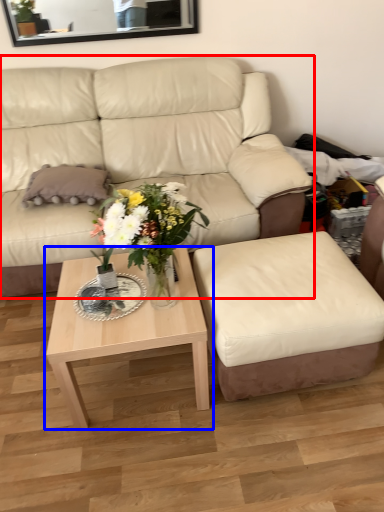
Question: Which object appears closest to the camera in this image, studio couch (highlighted by a red box) or coffee table (highlighted by a blue box)?

Choices:
 (A) studio couch
 (B) coffee table

Answer: (B)